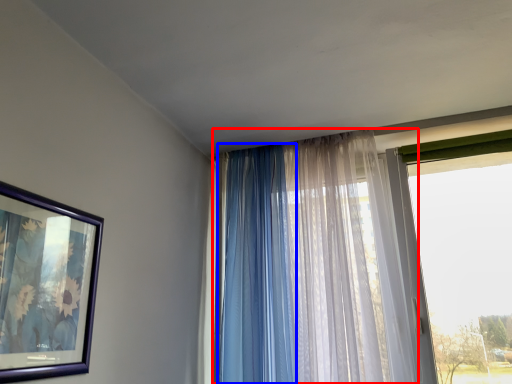
Question: Among these objects, which one is farthest to the camera, curtain (highlighted by a red box) or curtain (highlighted by a blue box)?

Choices:
 (A) curtain
 (B) curtain

Answer: (B)